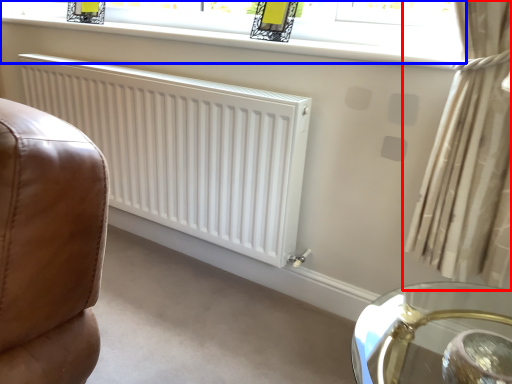
Question: Among these objects, which one is farthest to the camera, curtain (highlighted by a red box) or window (highlighted by a blue box)?

Choices:
 (A) curtain
 (B) window

Answer: (B)